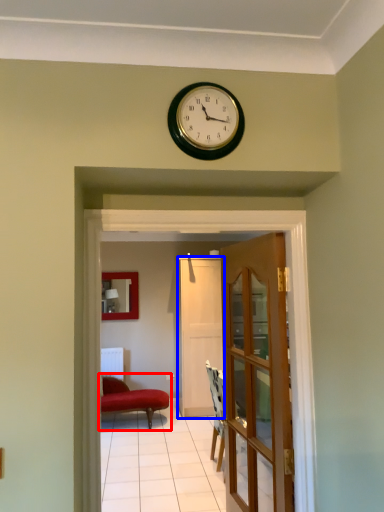
Question: Which point is further to the camera, studio couch (highlighted by a red box) or door (highlighted by a blue box)?

Choices:
 (A) studio couch
 (B) door

Answer: (B)